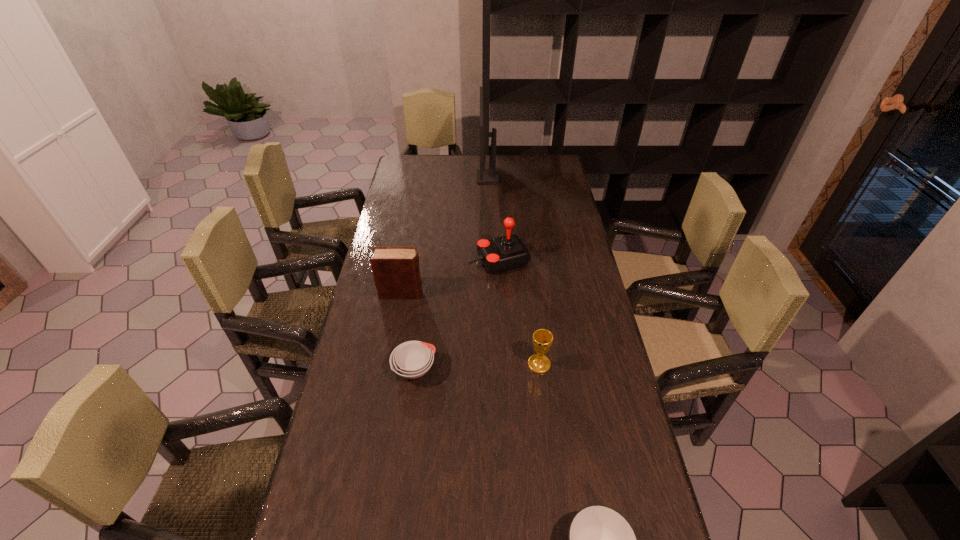
Where is `object that is the fifth closest to the shortest object`? This screenshot has width=960, height=540. object that is the fifth closest to the shortest object is located at coordinates (484, 176).

Where is `free space in the image that satisfies the following two spatial constraints: 1. on the front side of the joystick; 2. on the spine side of the third farthest object`? Image resolution: width=960 pixels, height=540 pixels. free space in the image that satisfies the following two spatial constraints: 1. on the front side of the joystick; 2. on the spine side of the third farthest object is located at coordinates (501, 293).

Where is `vacant space that satisfies the following two spatial constraints: 1. on the spine side of the third farthest object; 2. on the left side of the fourth tallest object`? The height and width of the screenshot is (540, 960). vacant space that satisfies the following two spatial constraints: 1. on the spine side of the third farthest object; 2. on the left side of the fourth tallest object is located at coordinates (389, 364).

I want to click on free space that satisfies the following two spatial constraints: 1. on the front side of the fifth nearest object; 2. on the spine side of the fourth nearest object, so click(x=501, y=293).

You are a GUI agent. You are given a task and a screenshot of the screen. Output one action in this format:
    pyautogui.click(x=<x>, y=<y>)
    Task: Click on the vacant space that satisfies the following two spatial constraints: 1. on the front-facing side of the tallest object; 2. on the back side of the fourth tallest object
    The height and width of the screenshot is (540, 960).
    Given the screenshot: What is the action you would take?
    pyautogui.click(x=492, y=364)

Identify the location of free space in the image that satisfies the following two spatial constraints: 1. on the back side of the joystick; 2. on the right side of the shortest object. Image resolution: width=960 pixels, height=540 pixels. (428, 261).